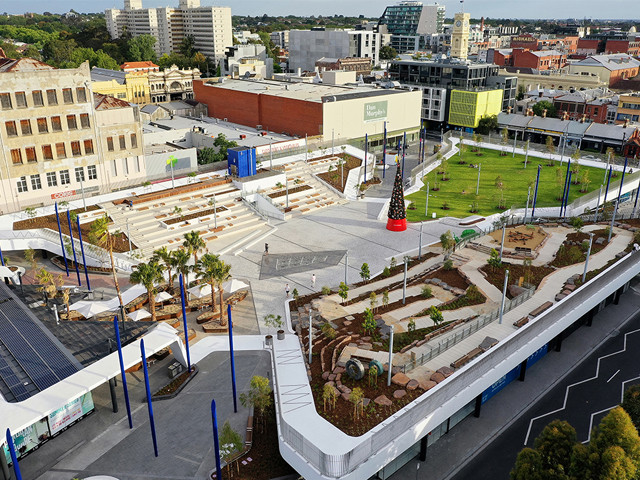
At what (x,y) coordinates should I click in order to perform the action: click on stairway. Please return your answer as a coordinate pair (x, y). Looking at the image, I should click on (86, 248), (352, 182).